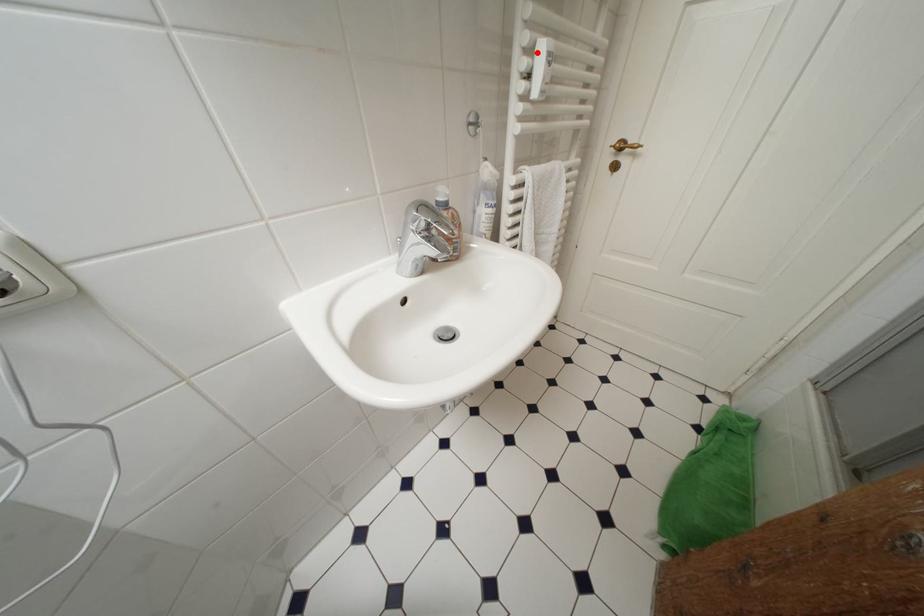
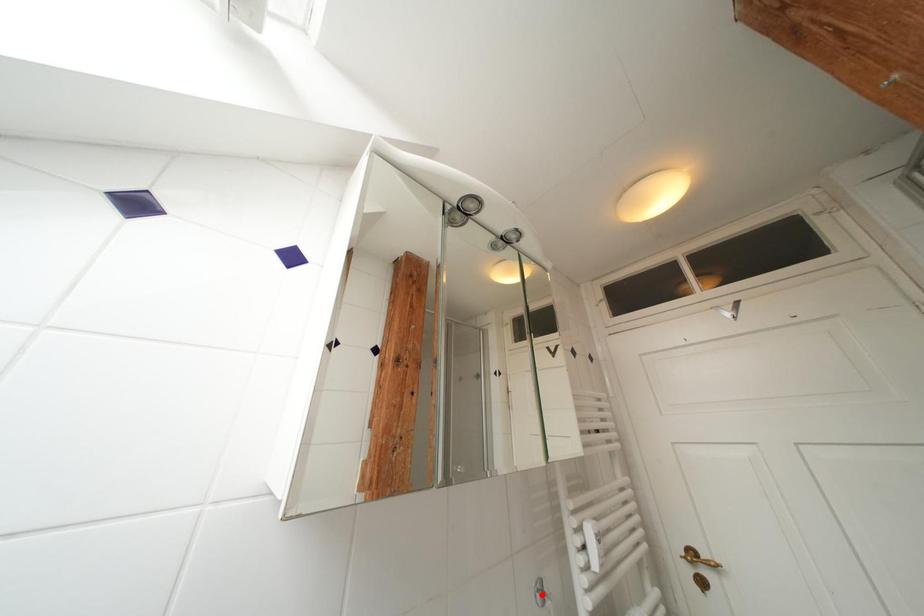
I am providing you with two images of the same scene from different viewpoints. A red point is marked on the first image and another point is marked on the second image. Is the red point in image1 aligned with the point shown in image2?

No